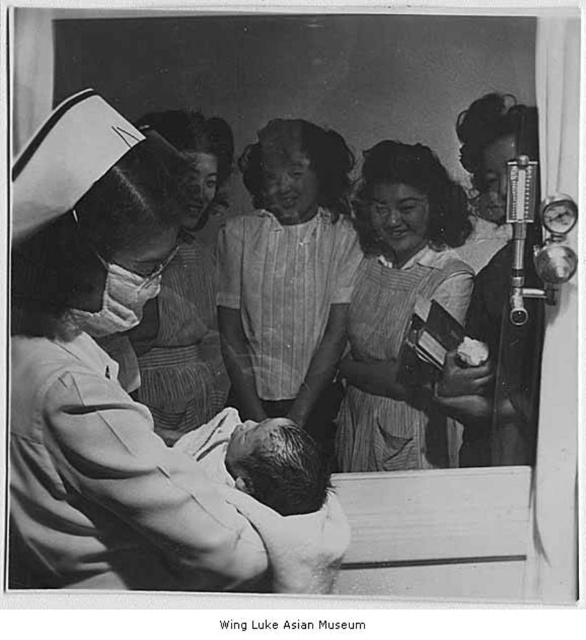
You are a nurse in the hospital and need to hand a medical kit to a colleague who is standing near the smooth fabric dress at right. The medical kit is currently on the counter next to the striped fabric blouse at center. Can you reach the medical kit from your current position without moving? Please explain your reasoning.

The striped fabric blouse at center and smooth fabric dress at right are 39.54 centimeters apart. Since the medical kit is on the counter next to the striped fabric blouse at center, and you need to hand it to someone near the smooth fabric dress at right, the distance between them is 39.54 centimeters. Nurses typically have an arm reach of about 60 centimeters, so you can likely reach the medical kit without moving.

You are a new parent visiting the hospital nursery. You see the white clothed nurse at left and the smooth skin baby at center. Which one is closer to you?

The white clothed nurse at left is closer to you because they are positioned over the smooth skin baby at center, meaning the nurse is in front of the baby in the frame.

In the photograph, there are a white clothed nurse at left and a smooth skin baby at center. Which of these two is located more to the left side?

The white clothed nurse at left is positioned on the left side of smooth skin baby at center, so the white clothed nurse at left is more to the left side.